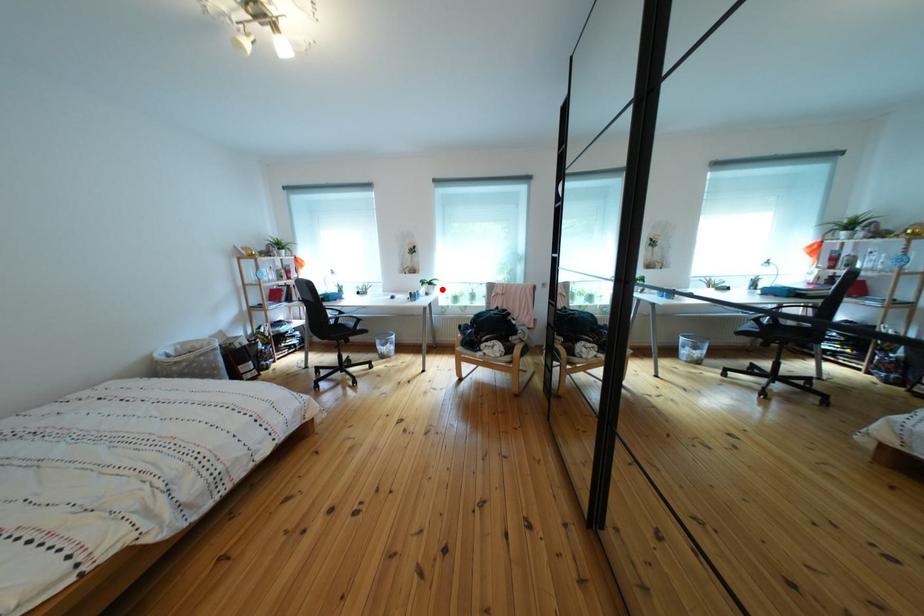
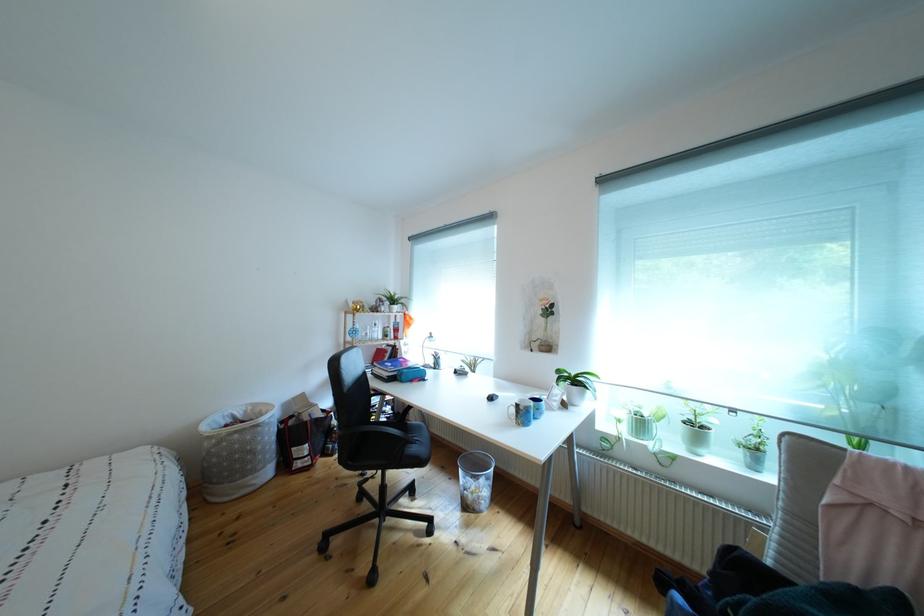
Question: A red point is marked in image1. In image2, is the corresponding 3D point closer to the camera or farther? Reply with the corresponding letter.

Choices:
 (A) The corresponding 3D point is closer.
 (B) The corresponding 3D point is farther.

Answer: (B)